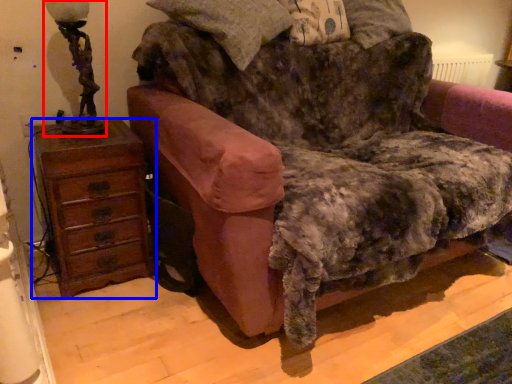
Question: Which of the following is the farthest to the observer, table lamp (highlighted by a red box) or chest of drawers (highlighted by a blue box)?

Choices:
 (A) table lamp
 (B) chest of drawers

Answer: (B)